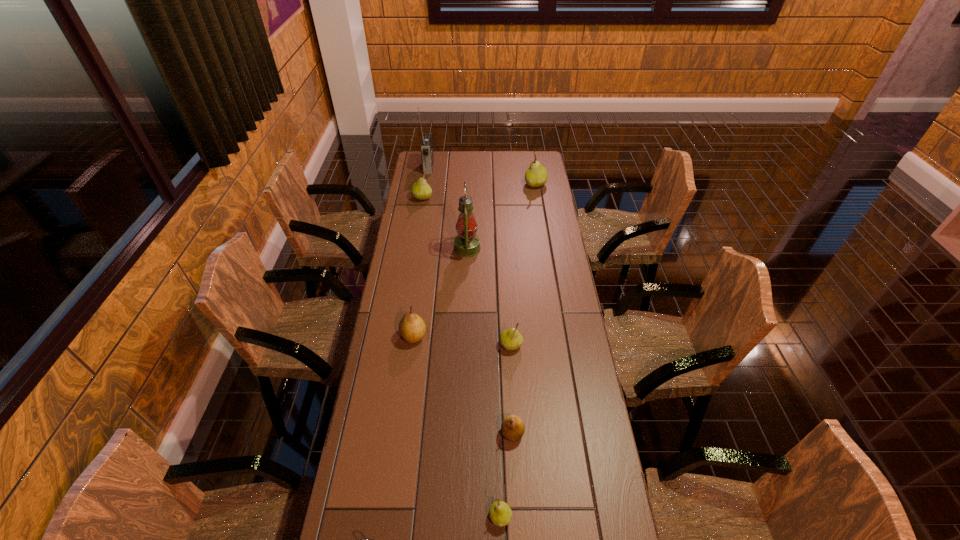
You are a GUI agent. You are given a task and a screenshot of the screen. Output one action in this format:
    pyautogui.click(x=<x>, y=<y>)
    Task: Click on the third nearest object
    Image resolution: width=960 pixels, height=540 pixels.
    Given the screenshot: What is the action you would take?
    pyautogui.click(x=512, y=427)

You are a GUI agent. You are given a task and a screenshot of the screen. Output one action in this format:
    pyautogui.click(x=<x>, y=<y>)
    Task: Click on the fifth farthest pear
    
    Given the screenshot: What is the action you would take?
    pyautogui.click(x=512, y=427)

The image size is (960, 540). What are the coordinates of `the nearest pear` in the screenshot? It's located at (500, 513).

I want to click on the second nearest object, so click(x=500, y=513).

Locate an element on the screen. The width and height of the screenshot is (960, 540). blank space located on the display of the farthest object is located at coordinates (473, 167).

The image size is (960, 540). Identify the location of free space located on the front of the green oil lamp. (466, 284).

Find the location of a particular element. This screenshot has width=960, height=540. vacant space located on the left of the third tallest object is located at coordinates click(x=515, y=184).

Where is `vacant space located on the front of the second biggest green pear`? Image resolution: width=960 pixels, height=540 pixels. vacant space located on the front of the second biggest green pear is located at coordinates (414, 248).

Image resolution: width=960 pixels, height=540 pixels. I want to click on free space located 0.350m on the front of the second smallest green pear, so click(x=517, y=453).

This screenshot has width=960, height=540. What are the coordinates of `vacant space located on the front of the left brown pear` in the screenshot? It's located at (407, 382).